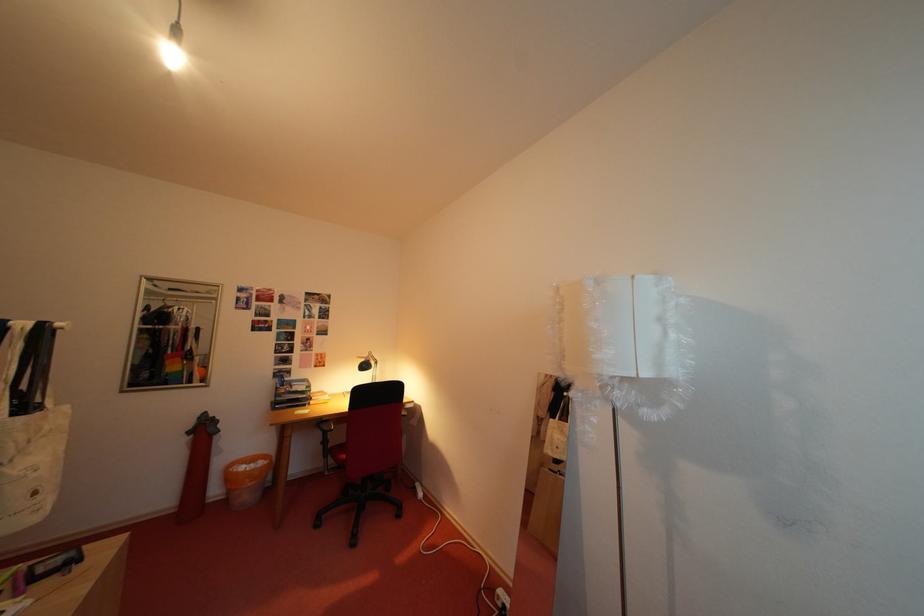
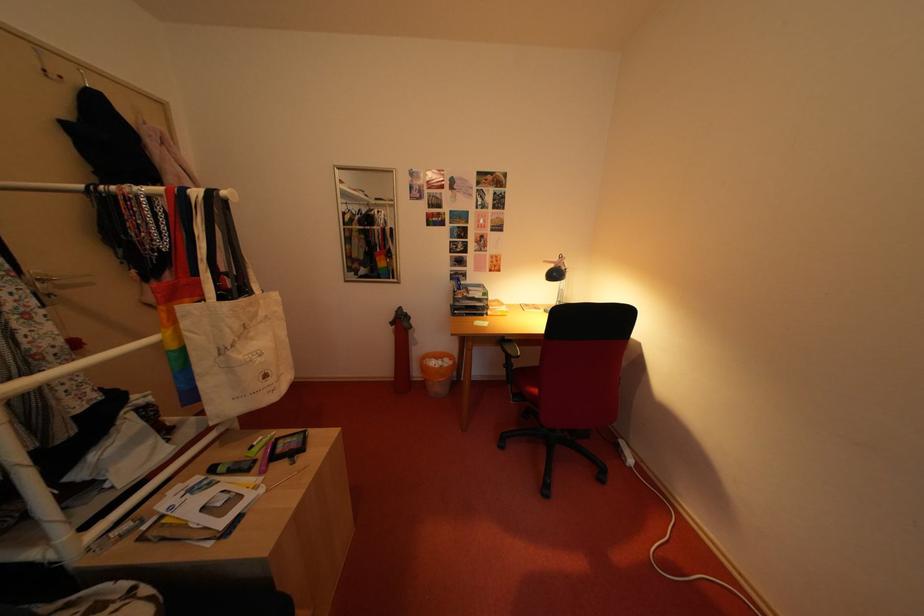
The images are taken continuously from a first-person perspective. In which direction is your viewpoint rotating?

The camera rotated toward left-down.